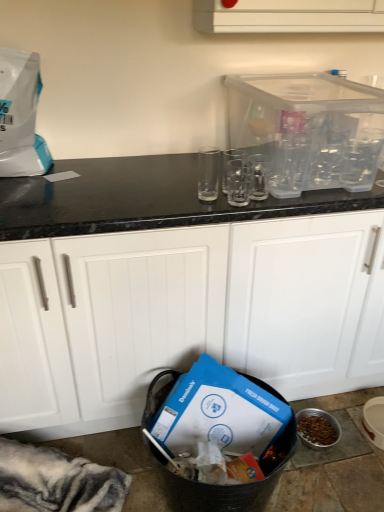
Identify the location of white matte cabinet at center. (186, 315).

This screenshot has height=512, width=384. I want to click on transparent plastic container at upper right, so click(309, 129).

Is the depth of clear glass at center, positioned as the second clear in right-to-left order, less than that of transparent glass at center, acting as the 3th clear starting from the right?

That is True.

Visually, is clear glass at center, positioned as the second clear in right-to-left order, positioned to the left or to the right of transparent glass at center, acting as the 3th clear starting from the right?

From the image, it's evident that clear glass at center, positioned as the second clear in right-to-left order, is to the right of transparent glass at center, acting as the 3th clear starting from the right.

Looking at this image, does clear glass at center, which ranks as the 2th clear in left-to-right order, have a lesser height compared to transparent glass at center, which is the first clear in left-to-right order?

Yes.

From the image's perspective, is clear glass at center, which ranks as the 2th clear in left-to-right order, above transparent glass at center, acting as the 3th clear starting from the right?

Incorrect, from the image's perspective, clear glass at center, which ranks as the 2th clear in left-to-right order, is lower than transparent glass at center, acting as the 3th clear starting from the right.

Could you tell me if transparent plastic container at upper right is facing clear glass at center, which ranks as the 3th clear in left-to-right order?

No, transparent plastic container at upper right is not turned towards clear glass at center, which ranks as the 3th clear in left-to-right order.

Which is more to the right, transparent plastic container at upper right or clear glass at center, which ranks as the 3th clear in left-to-right order?

Positioned to the right is transparent plastic container at upper right.

From the image's perspective, which is below, transparent plastic container at upper right or clear glass at center, which ranks as the 3th clear in left-to-right order?

From the image's view, clear glass at center, which ranks as the 3th clear in left-to-right order, is below.

From a real-world perspective, is clear glass at center, which ranks as the 3th clear in left-to-right order, positioned above or below transparent plastic container at upper right?

In terms of real-world spatial position, clear glass at center, which ranks as the 3th clear in left-to-right order, is below transparent plastic container at upper right.

From the image's perspective, is clear glass at center, which ranks as the 3th clear in left-to-right order, above transparent plastic container at upper right?

No, from the image's perspective, clear glass at center, which ranks as the 3th clear in left-to-right order, is not above transparent plastic container at upper right.

From the picture: Is clear glass at center, marked as the 1th clear in a right-to-left arrangement, next to transparent plastic container at upper right and touching it?

No.

Between clear glass at center, marked as the 1th clear in a right-to-left arrangement, and transparent plastic container at upper right, which one has smaller size?

clear glass at center, marked as the 1th clear in a right-to-left arrangement.

From the image's perspective, would you say white matte cabinet at center is positioned over clear glass at center, which ranks as the 3th clear in left-to-right order?

No, from the image's perspective, white matte cabinet at center is not above clear glass at center, which ranks as the 3th clear in left-to-right order.

Between white matte cabinet at center and clear glass at center, which ranks as the 3th clear in left-to-right order, which one has larger width?

white matte cabinet at center is wider.

Which of these two, white matte cabinet at center or clear glass at center, marked as the 1th clear in a right-to-left arrangement, is bigger?

With larger size is white matte cabinet at center.

Consider the image. From a real-world perspective, who is located higher, white matte cabinet at center or clear glass at center, marked as the 1th clear in a right-to-left arrangement?

clear glass at center, marked as the 1th clear in a right-to-left arrangement.

Is point (145, 304) positioned after point (245, 181)?

No.

Would you say clear glass at center, positioned as the second clear in right-to-left order, is part of white matte cabinet at center's contents?

No, clear glass at center, positioned as the second clear in right-to-left order, is not surrounded by white matte cabinet at center.

Is white matte cabinet at center behind clear glass at center, positioned as the second clear in right-to-left order?

No, it is not.

How many degrees apart are the facing directions of white matte cabinet at center and clear glass at center, positioned as the second clear in right-to-left order?

white matte cabinet at center and clear glass at center, positioned as the second clear in right-to-left order, are facing 0.502 degrees away from each other.

From a real-world perspective, which is physically below, transparent plastic container at upper right or white matte cabinet at center?

From a 3D spatial view, white matte cabinet at center is below.

Consider the image. Which is closer to the camera, (359, 116) or (149, 252)?

Clearly, point (359, 116) is more distant from the camera than point (149, 252).

Does transparent plastic container at upper right have a larger size compared to white matte cabinet at center?

Actually, transparent plastic container at upper right might be smaller than white matte cabinet at center.

Where is `cabinetry lying in front of the transparent plastic container at upper right`? This screenshot has width=384, height=512. cabinetry lying in front of the transparent plastic container at upper right is located at coordinates (186, 315).

From the image's perspective, does transparent plastic container at upper right appear lower than transparent glass at center, which is the first clear in left-to-right order?

Actually, transparent plastic container at upper right appears above transparent glass at center, which is the first clear in left-to-right order, in the image.

Is transparent plastic container at upper right looking in the opposite direction of transparent glass at center, which is the first clear in left-to-right order?

No, transparent glass at center, which is the first clear in left-to-right order, is not at the back of transparent plastic container at upper right.

Considering the relative sizes of transparent plastic container at upper right and transparent glass at center, which is the first clear in left-to-right order, in the image provided, is transparent plastic container at upper right shorter than transparent glass at center, which is the first clear in left-to-right order,?

No.

Is transparent plastic container at upper right wider than transparent glass at center, acting as the 3th clear starting from the right?

Indeed, transparent plastic container at upper right has a greater width compared to transparent glass at center, acting as the 3th clear starting from the right.

The width and height of the screenshot is (384, 512). In order to click on clear in front of the transparent glass at center, acting as the 3th clear starting from the right in this screenshot , I will do `click(238, 182)`.

This screenshot has width=384, height=512. There is a transparent plastic container at upper right. Find the location of `the 2nd clear below it (from a real-world perspective)`. the 2nd clear below it (from a real-world perspective) is located at coordinates (259, 176).

When comparing their distances from clear glass at center, marked as the 1th clear in a right-to-left arrangement, does transparent plastic container at upper right or clear glass at center, positioned as the second clear in right-to-left order, seem closer?

A: Based on the image, clear glass at center, positioned as the second clear in right-to-left order, appears to be nearer to clear glass at center, marked as the 1th clear in a right-to-left arrangement.

Which object lies nearer to the anchor point transparent plastic container at upper right, white matte cabinet at center or clear glass at center, positioned as the second clear in right-to-left order?

clear glass at center, positioned as the second clear in right-to-left order, is closer to transparent plastic container at upper right.

Which object lies further to the anchor point transparent plastic container at upper right, clear glass at center, marked as the 1th clear in a right-to-left arrangement, or clear glass at center, which ranks as the 2th clear in left-to-right order?

The object further to transparent plastic container at upper right is clear glass at center, which ranks as the 2th clear in left-to-right order.

Considering their positions, is white matte cabinet at center positioned closer to clear glass at center, positioned as the second clear in right-to-left order, than clear glass at center, which ranks as the 3th clear in left-to-right order?

Among the two, clear glass at center, which ranks as the 3th clear in left-to-right order, is located nearer to clear glass at center, positioned as the second clear in right-to-left order.

Looking at the image, which one is located closer to clear glass at center, positioned as the second clear in right-to-left order, transparent glass at center, which is the first clear in left-to-right order, or white matte cabinet at center?

transparent glass at center, which is the first clear in left-to-right order.

Based on their spatial positions, is white matte cabinet at center or clear glass at center, marked as the 1th clear in a right-to-left arrangement, further from transparent plastic container at upper right?

The object further to transparent plastic container at upper right is white matte cabinet at center.

Considering their positions, is transparent plastic container at upper right positioned further to clear glass at center, marked as the 1th clear in a right-to-left arrangement, than transparent glass at center, which is the first clear in left-to-right order?

transparent glass at center, which is the first clear in left-to-right order, is positioned further to the anchor clear glass at center, marked as the 1th clear in a right-to-left arrangement.

When comparing their distances from transparent plastic container at upper right, does transparent glass at center, acting as the 3th clear starting from the right, or clear glass at center, positioned as the second clear in right-to-left order, seem further?

The object further to transparent plastic container at upper right is transparent glass at center, acting as the 3th clear starting from the right.

Where is `clear between clear glass at center, marked as the 1th clear in a right-to-left arrangement, and white matte cabinet at center, in the vertical direction`? clear between clear glass at center, marked as the 1th clear in a right-to-left arrangement, and white matte cabinet at center, in the vertical direction is located at coordinates (238, 182).

At what (x,y) coordinates should I click in order to perform the action: click on clear between transparent glass at center, which is the first clear in left-to-right order, and clear glass at center, which ranks as the 3th clear in left-to-right order, in the horizontal direction. Please return your answer as a coordinate pair (x, y). This screenshot has width=384, height=512. Looking at the image, I should click on (238, 182).